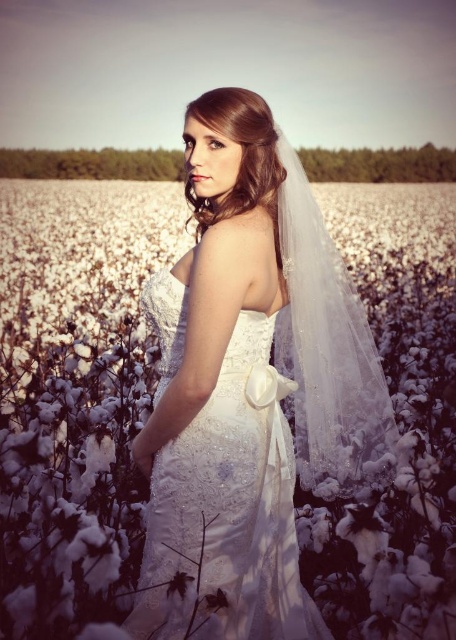
Can you confirm if white lace veil at upper center is smaller than satin white dress at center?

No, white lace veil at upper center is not smaller than satin white dress at center.

The height and width of the screenshot is (640, 456). I want to click on white lace veil at upper center, so click(x=74, y=394).

Identify the location of white lace veil at upper center. The width and height of the screenshot is (456, 640). (74, 394).